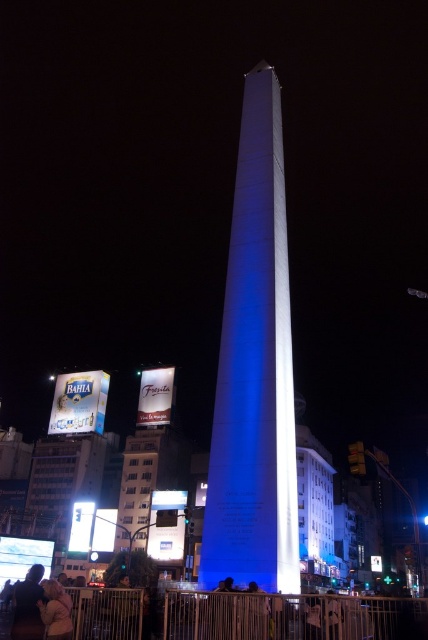
Question: Is matte black shirt at lower left above blonde hair at lower left?

Choices:
 (A) no
 (B) yes

Answer: (A)

Question: Which object appears closest to the camera in this image?

Choices:
 (A) white polished stone obelisk at center
 (B) blonde hair at lower left
 (C) matte black shirt at lower left

Answer: (C)

Question: Which object appears closest to the camera in this image?

Choices:
 (A) blonde hair at lower left
 (B) matte black shirt at lower left
 (C) white polished stone obelisk at center

Answer: (B)

Question: Is white polished stone obelisk at center below matte black shirt at lower left?

Choices:
 (A) no
 (B) yes

Answer: (A)

Question: Does white polished stone obelisk at center appear on the left side of matte black shirt at lower left?

Choices:
 (A) no
 (B) yes

Answer: (A)

Question: Among these points, which one is nearest to the camera?

Choices:
 (A) (56, 609)
 (B) (294, 518)

Answer: (A)